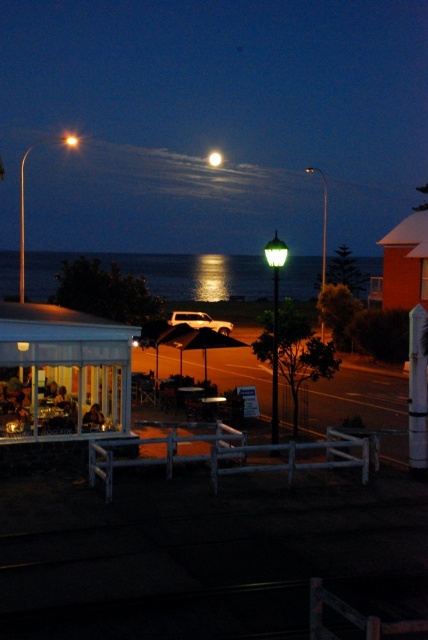
Is transparent glass gazebo at lower left thinner than bright white orb at upper center?

Indeed, transparent glass gazebo at lower left has a lesser width compared to bright white orb at upper center.

Which is below, transparent glass gazebo at lower left or bright white orb at upper center?

transparent glass gazebo at lower left is below.

Which is in front, point (56, 365) or point (222, 157)?

Point (56, 365)

Locate an element on the screen. Image resolution: width=428 pixels, height=640 pixels. transparent glass gazebo at lower left is located at coordinates (59, 384).

Does transparent glass gazebo at lower left appear on the right side of white painted wood post at center right?

Incorrect, transparent glass gazebo at lower left is not on the right side of white painted wood post at center right.

Which is above, transparent glass gazebo at lower left or white painted wood post at center right?

Positioned higher is white painted wood post at center right.

What do you see at coordinates (59, 384) in the screenshot? I see `transparent glass gazebo at lower left` at bounding box center [59, 384].

Identify the location of transparent glass gazebo at lower left. (59, 384).

Is white painted wood post at center right bigger than bright white orb at upper center?

No.

Describe the element at coordinates (416, 392) in the screenshot. I see `white painted wood post at center right` at that location.

Who is more forward, (419, 348) or (211, 152)?

Point (419, 348) is more forward.

Find the location of a particular element. The image size is (428, 640). white painted wood post at center right is located at coordinates (416, 392).